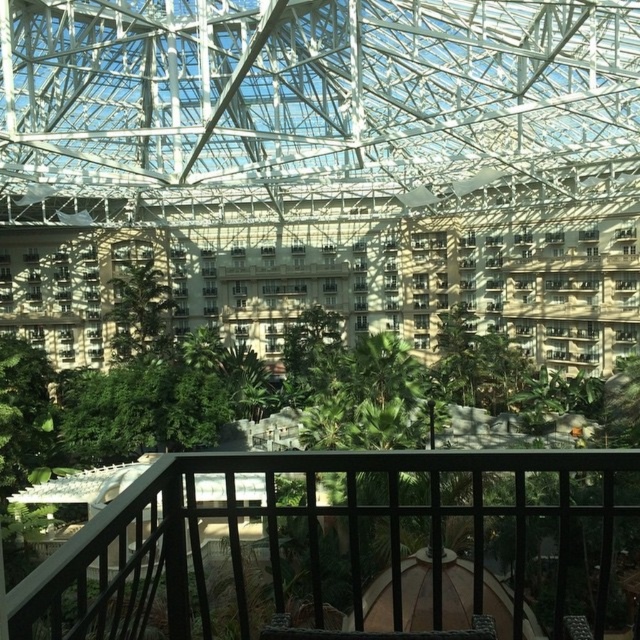
Question: Estimate the real-world distances between objects in this image. Which object is closer to the green leafy tree at center?

Choices:
 (A) black wood railing at center
 (B) beige concrete building at center

Answer: (B)

Question: Which point is closer to the camera?

Choices:
 (A) green leafy tree at center
 (B) beige concrete building at center
 (C) black wood railing at center

Answer: (C)

Question: Is beige concrete building at center to the left of green leafy tree at center from the viewer's perspective?

Choices:
 (A) yes
 (B) no

Answer: (B)

Question: Can you confirm if black wood railing at center is positioned above beige concrete building at center?

Choices:
 (A) no
 (B) yes

Answer: (A)

Question: Which object is farther from the camera taking this photo?

Choices:
 (A) green leafy tree at center
 (B) beige concrete building at center

Answer: (A)

Question: Is beige concrete building at center to the right of green leafy tree at center from the viewer's perspective?

Choices:
 (A) yes
 (B) no

Answer: (A)